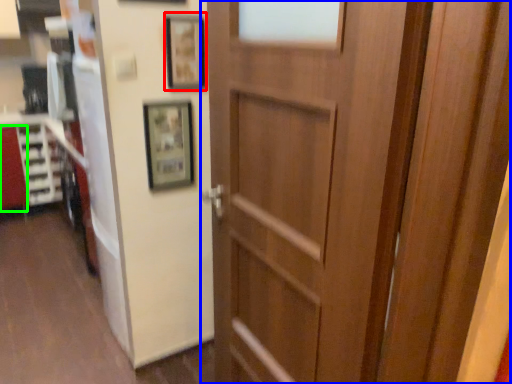
Question: Which object is the closest to the picture frame (highlighted by a red box)? Choose among these: door (highlighted by a blue box) or cabinetry (highlighted by a green box).

Choices:
 (A) door
 (B) cabinetry

Answer: (A)